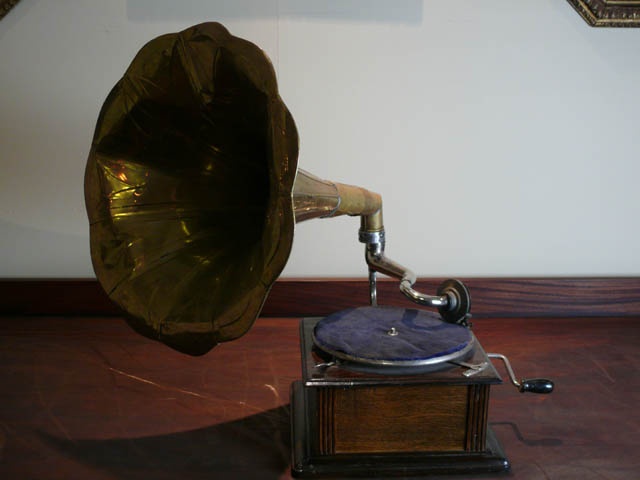
Where is `front of old record player`? This screenshot has height=480, width=640. front of old record player is located at coordinates (420, 422), (367, 407), (374, 437), (441, 393).